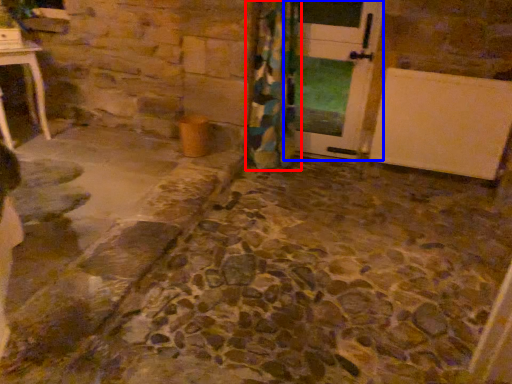
Question: Which object appears closest to the camera in this image, curtain (highlighted by a red box) or door (highlighted by a blue box)?

Choices:
 (A) curtain
 (B) door

Answer: (A)